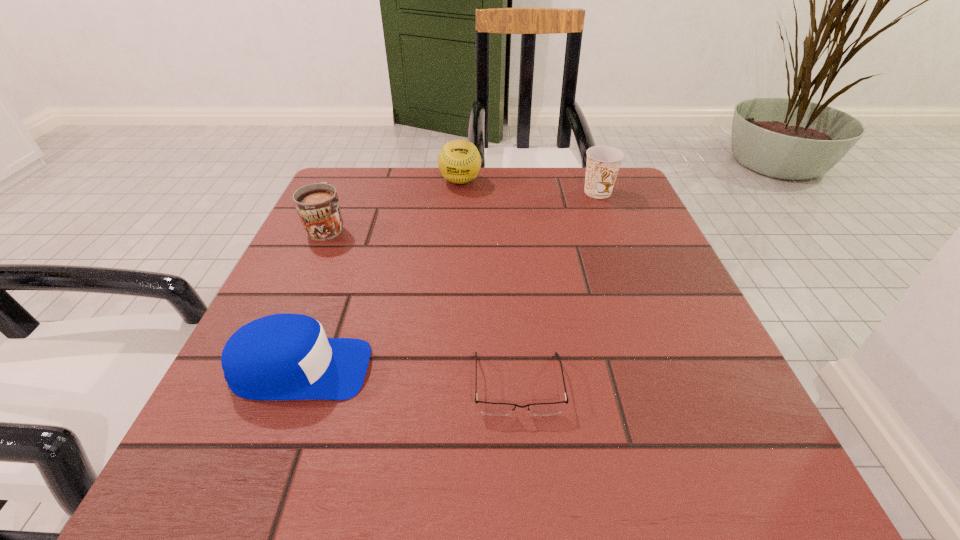
In the image, there is a desktop. At what (x,y) coordinates should I click in order to perform the action: click on vacant area at the far edge. Please return your answer as a coordinate pair (x, y). This screenshot has height=540, width=960. Looking at the image, I should click on (486, 183).

In the image, there is a desktop. Where is `vacant space at the near edge`? This screenshot has width=960, height=540. vacant space at the near edge is located at coordinates (377, 481).

This screenshot has width=960, height=540. What are the coordinates of `blank space at the left edge of the desktop` in the screenshot? It's located at (319, 318).

Identify the location of free location at the right edge of the desktop. (686, 318).

The height and width of the screenshot is (540, 960). Identify the location of vacant space at the far right corner of the desktop. (608, 206).

The image size is (960, 540). Identify the location of vacant region at the near right corner of the desktop. (668, 488).

Identify the location of vacant region between the baseball cap and the softball. The image size is (960, 540). (380, 275).

Identify the location of free space between the softball and the Dixie cup. (529, 187).

Locate an element on the screen. free space that is in between the shortest object and the softball is located at coordinates (490, 283).

Where is `vacant area between the softball and the mug`? The width and height of the screenshot is (960, 540). vacant area between the softball and the mug is located at coordinates (394, 204).